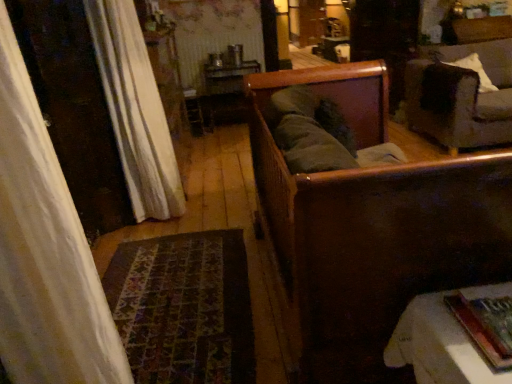
Question: Visually, is white textured curtain at left positioned to the left or to the right of white fabric tablecloth at lower right, which is the 1th furniture from back to front?

Choices:
 (A) left
 (B) right

Answer: (A)

Question: From the image's perspective, is white textured curtain at left positioned above or below white fabric tablecloth at lower right, the second furniture positioned from the front?

Choices:
 (A) above
 (B) below

Answer: (A)

Question: Which object is positioned closest to the white soft pillow at upper right?

Choices:
 (A) white textured curtain at left
 (B) wooden sofa at center, the 1th furniture positioned from the front
 (C) hardcover book at lower right
 (D) white fabric tablecloth at lower right, which is the 1th furniture from back to front
 (E) dark gray fabric couch at upper right

Answer: (E)

Question: Estimate the real-world distances between objects in this image. Which object is closer to the white fabric tablecloth at lower right, which is the 1th furniture from back to front?

Choices:
 (A) hardcover book at lower right
 (B) dark gray fabric couch at upper right
 (C) white soft pillow at upper right
 (D) wooden sofa at center, the 1th furniture positioned from the front
 (E) white textured curtain at left

Answer: (A)